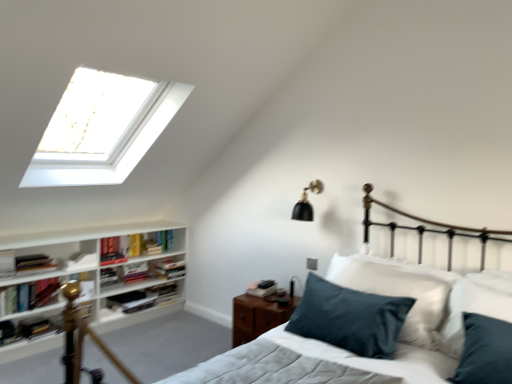
Question: Based on their sizes in the image, would you say hardcover book at center, placed as the 3th book when sorted from bottom to top, is bigger or smaller than hardcover book at upper left, which is the 5th book in bottom-to-top order?

Choices:
 (A) small
 (B) big

Answer: (B)

Question: Looking at their shapes, would you say hardcover book at center, placed as the 3th book when sorted from bottom to top, is wider or thinner than hardcover book at upper left, which is the 5th book from top to bottom?

Choices:
 (A) wide
 (B) thin

Answer: (A)

Question: Which of these objects is positioned closest to the hardcover book at left, marked as the 9th book in a top-to-bottom arrangement?

Choices:
 (A) hardcover book at center, the 7th book viewed from the top
 (B) hardcover book at center-left, which is counted as the sixth book, starting from the bottom
 (C) hardcover book at left, placed as the 1th book when sorted from top to bottom
 (D) wooden nightstand at lower right
 (E) hardcover book at upper left, which is the 5th book from top to bottom

Answer: (C)

Question: Which object is the farthest from the hardcover book at center, placed as the 3th book when sorted from bottom to top?

Choices:
 (A) wooden nightstand at lower right
 (B) teal satin pillow at center
 (C) hardcover book at left, marked as the 2th book in a top-to-bottom arrangement
 (D) white wooden bookshelf at left
 (E) hardcover book at left, which appears as the sixth book when viewed from the top

Answer: (B)